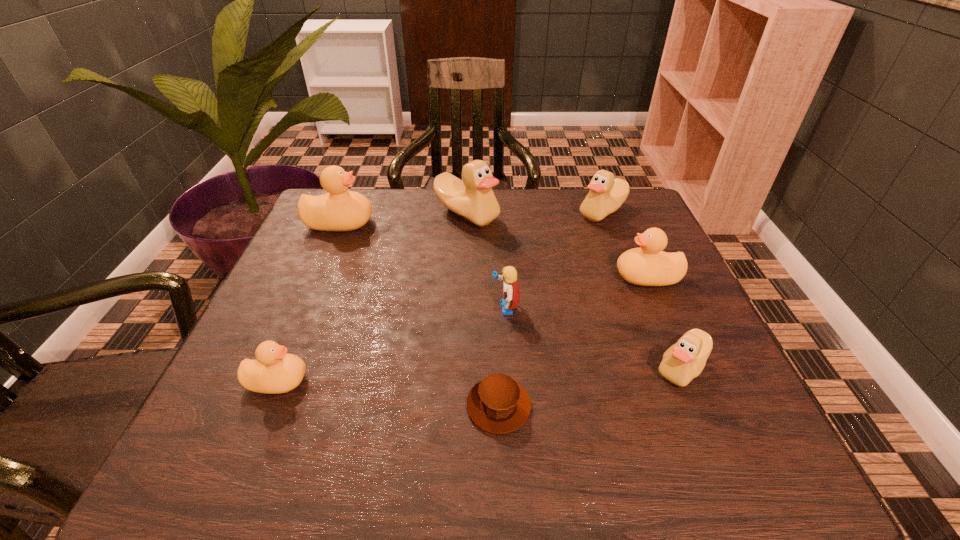
Where is `muffin`? The height and width of the screenshot is (540, 960). muffin is located at coordinates (497, 404).

Find the location of a particular element. vacant space located at the beak of the biggest beige duck is located at coordinates (466, 245).

Find the location of a particular element. blank space located 0.180m on the face of the biggest yellow duck is located at coordinates (441, 223).

The height and width of the screenshot is (540, 960). Identify the location of vacant space located at the beak of the second biggest beige duck. coord(493,212).

Where is `vacant space located at the beak of the second biggest beige duck`? This screenshot has width=960, height=540. vacant space located at the beak of the second biggest beige duck is located at coordinates (534, 212).

At what (x,y) coordinates should I click in order to perform the action: click on free space located 0.120m at the beak of the second biggest beige duck. Please return your answer as a coordinate pair (x, y). The image size is (960, 540). Looking at the image, I should click on (534, 212).

Locate an element on the screen. This screenshot has width=960, height=540. free space located 0.070m on the face of the second nearest yellow duck is located at coordinates (586, 277).

Locate an element on the screen. free space located 0.400m on the face of the second nearest yellow duck is located at coordinates (442, 277).

Identify the location of free region located on the face of the second nearest yellow duck. (512, 277).

Locate an element on the screen. free space located 0.250m on the front-facing side of the Lego is located at coordinates (373, 308).